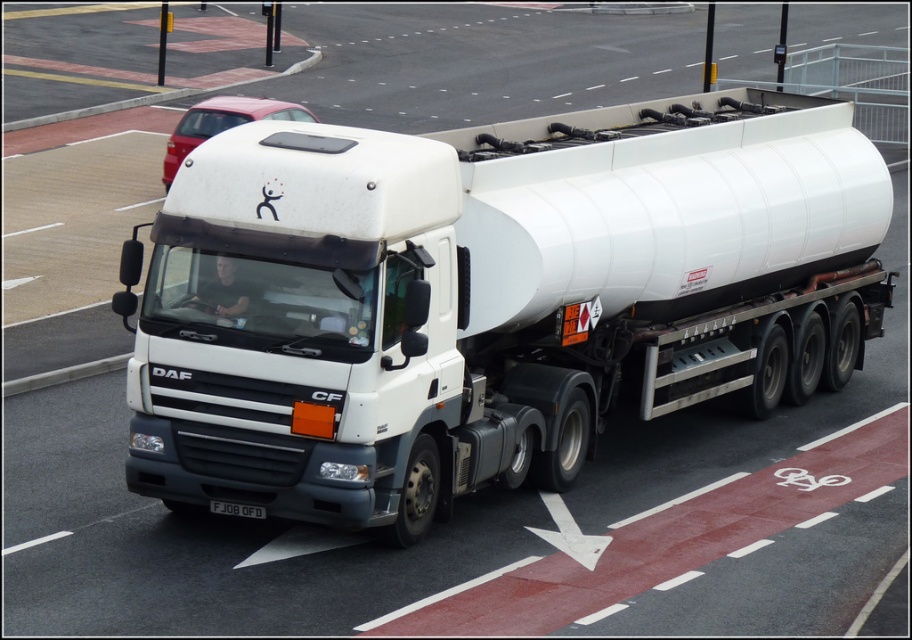
Between point (164, 348) and point (234, 513), which one is positioned behind?

The point (234, 513) is behind.

Does white matte tanker at center lie behind white plastic license plate at center?

No, white matte tanker at center is closer to the viewer.

This screenshot has width=912, height=640. In order to click on white matte tanker at center in this screenshot , I will do `click(488, 298)`.

Does point (525, 134) come closer to viewer compared to point (267, 102)?

Yes, it is.

Is point (495, 202) less distant than point (167, 157)?

Yes.

Find the location of `white matte tanker at center`. white matte tanker at center is located at coordinates (488, 298).

Does metallic red car at upper center have a greater width compared to white plastic license plate at center?

Yes, metallic red car at upper center is wider than white plastic license plate at center.

Which is more to the left, metallic red car at upper center or white plastic license plate at center?

metallic red car at upper center

Is point (286, 108) farther from camera compared to point (230, 502)?

Yes, point (286, 108) is farther from viewer.

Find the location of `metallic red car at upper center`. metallic red car at upper center is located at coordinates (223, 124).